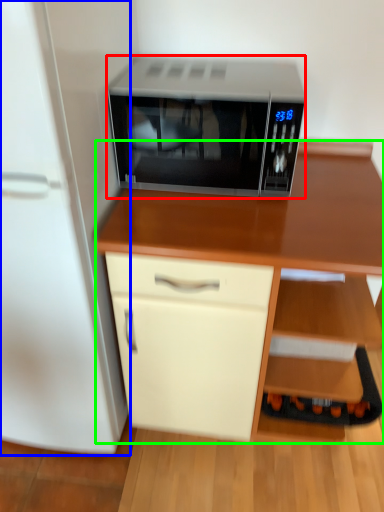
Question: Based on their relative distances, which object is farther from microwave oven (highlighted by a red box)? Choose from refrigerator (highlighted by a blue box) and desk (highlighted by a green box).

Choices:
 (A) refrigerator
 (B) desk

Answer: (A)